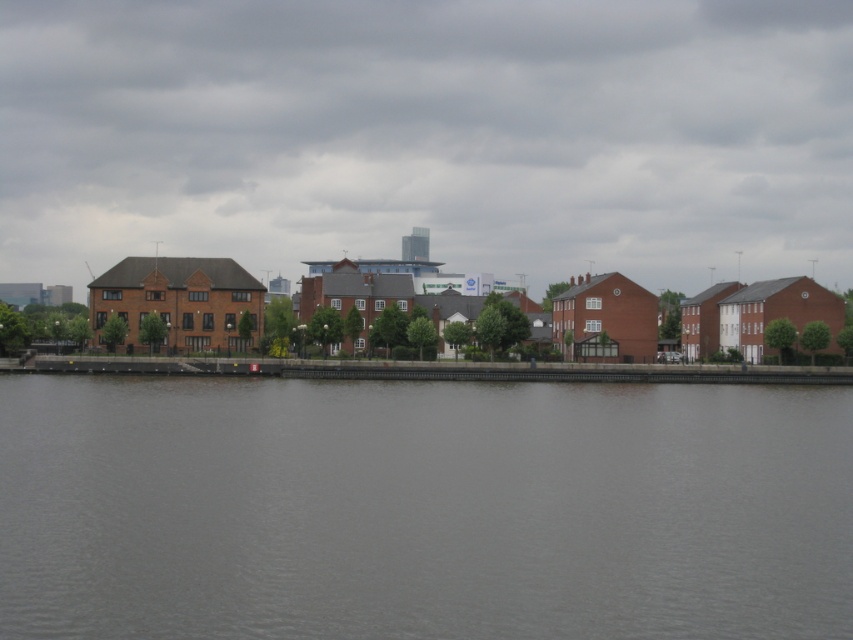
Question: In this image, where is matte brick buildings at center located relative to gray water at center?

Choices:
 (A) below
 (B) above

Answer: (B)

Question: Can you confirm if matte brick buildings at center is positioned to the right of gray water at center?

Choices:
 (A) no
 (B) yes

Answer: (A)

Question: Can you confirm if matte brick buildings at center is wider than gray water at center?

Choices:
 (A) yes
 (B) no

Answer: (A)

Question: Which of the following is the closest to the observer?

Choices:
 (A) matte brick buildings at center
 (B) gray water at center

Answer: (B)

Question: Which object appears closest to the camera in this image?

Choices:
 (A) matte brick buildings at center
 (B) gray water at center

Answer: (B)